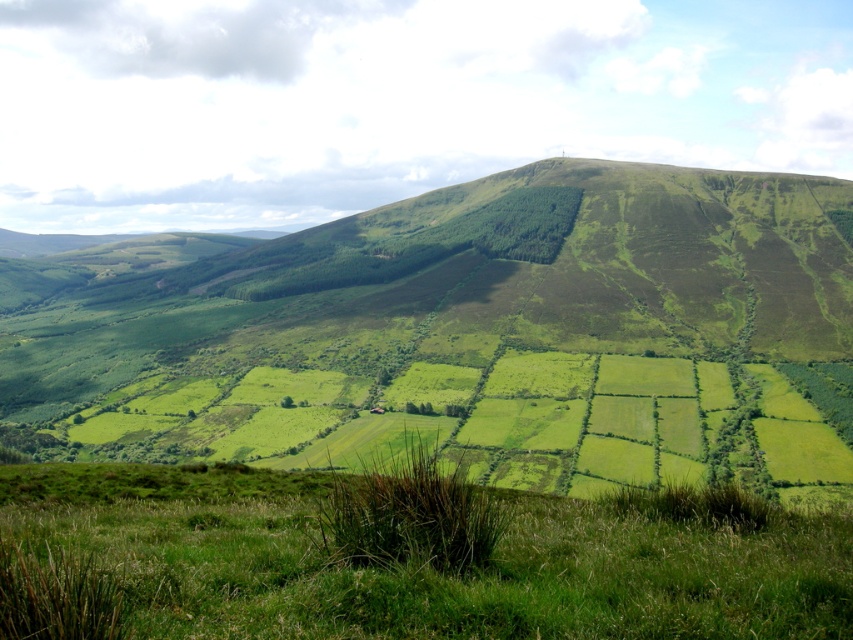
Which is in front, point (596, 173) or point (160, 563)?

Point (160, 563) is in front.

Can you confirm if green grassy hill at center is bigger than green grassy at lower center?

Correct, green grassy hill at center is larger in size than green grassy at lower center.

This screenshot has height=640, width=853. I want to click on green grassy hill at center, so click(463, 333).